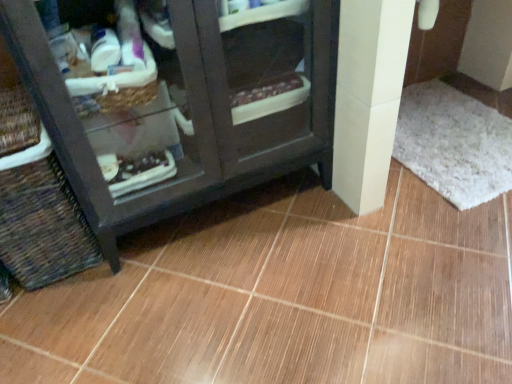
Identify the location of dark wood cabinet at lower left. The image size is (512, 384). (182, 104).

The width and height of the screenshot is (512, 384). Describe the element at coordinates (283, 296) in the screenshot. I see `brown glossy tile at center` at that location.

Describe the element at coordinates (42, 226) in the screenshot. I see `woven brown basket at lower left` at that location.

Find the location of a particular element. dark wood cabinet at lower left is located at coordinates (182, 104).

Where is `furniture in front of the white shaggy bath mat at lower right`? furniture in front of the white shaggy bath mat at lower right is located at coordinates (182, 104).

Is white shaggy bath mat at lower right turned away from dark wood cabinet at lower left?

No, white shaggy bath mat at lower right's orientation is not away from dark wood cabinet at lower left.

Between white shaggy bath mat at lower right and dark wood cabinet at lower left, which one has smaller size?

Smaller between the two is white shaggy bath mat at lower right.

Is point (16, 227) behind point (222, 169)?

No, it is in front of (222, 169).

Could you tell me if woven brown basket at lower left is turned towards dark wood cabinet at lower left?

No, woven brown basket at lower left is not oriented towards dark wood cabinet at lower left.

This screenshot has width=512, height=384. I want to click on basket below the dark wood cabinet at lower left (from the image's perspective), so click(x=42, y=226).

Can you confirm if woven brown basket at lower left is bigger than dark wood cabinet at lower left?

Incorrect, woven brown basket at lower left is not larger than dark wood cabinet at lower left.

Considering the sizes of brown glossy tile at center and dark wood cabinet at lower left in the image, is brown glossy tile at center wider or thinner than dark wood cabinet at lower left?

brown glossy tile at center is wider than dark wood cabinet at lower left.

Is brown glossy tile at center completely or partially outside of dark wood cabinet at lower left?

Indeed, brown glossy tile at center is completely outside dark wood cabinet at lower left.

Is brown glossy tile at center positioned with its back to dark wood cabinet at lower left?

No, brown glossy tile at center's orientation is not away from dark wood cabinet at lower left.

Considering the relative sizes of brown glossy tile at center and dark wood cabinet at lower left in the image provided, is brown glossy tile at center taller than dark wood cabinet at lower left?

In fact, brown glossy tile at center may be shorter than dark wood cabinet at lower left.

Is white shaggy bath mat at lower right looking in the opposite direction of brown glossy tile at center?

Correct, white shaggy bath mat at lower right is looking away from brown glossy tile at center.

In the scene shown: Considering the relative sizes of white shaggy bath mat at lower right and brown glossy tile at center in the image provided, is white shaggy bath mat at lower right wider than brown glossy tile at center?

In fact, white shaggy bath mat at lower right might be narrower than brown glossy tile at center.

Is white shaggy bath mat at lower right surrounding brown glossy tile at center?

No, brown glossy tile at center is not a part of white shaggy bath mat at lower right.

Is brown glossy tile at center positioned far away from woven brown basket at lower left?

That's not correct — brown glossy tile at center is a little close to woven brown basket at lower left.

Which object is thinner, brown glossy tile at center or woven brown basket at lower left?

woven brown basket at lower left.

Between brown glossy tile at center and woven brown basket at lower left, which one has less height?

brown glossy tile at center is shorter.

Can you confirm if woven brown basket at lower left is taller than brown glossy tile at center?

Yes.

Is point (42, 253) closer to camera compared to point (477, 358)?

No, it is behind (477, 358).

Find the location of `ceramic tile located on the right of woven brown basket at lower left`. ceramic tile located on the right of woven brown basket at lower left is located at coordinates (283, 296).

From the image's perspective, does dark wood cabinet at lower left appear lower than woven brown basket at lower left?

No.

Locate an element on the screen. The width and height of the screenshot is (512, 384). basket behind the dark wood cabinet at lower left is located at coordinates (42, 226).

Is dark wood cabinet at lower left in contact with woven brown basket at lower left?

No, dark wood cabinet at lower left is not with woven brown basket at lower left.

Between dark wood cabinet at lower left and woven brown basket at lower left, which one appears on the right side from the viewer's perspective?

From the viewer's perspective, dark wood cabinet at lower left appears more on the right side.

Where is `bath mat on the right of dark wood cabinet at lower left`? The image size is (512, 384). bath mat on the right of dark wood cabinet at lower left is located at coordinates (454, 142).

Locate an element on the screen. basket behind the dark wood cabinet at lower left is located at coordinates (42, 226).

Estimate the real-world distances between objects in this image. Which object is further from brown glossy tile at center, woven brown basket at lower left or dark wood cabinet at lower left?

woven brown basket at lower left.

When comparing their distances from brown glossy tile at center, does white shaggy bath mat at lower right or dark wood cabinet at lower left seem closer?

dark wood cabinet at lower left.

From the image, which object appears to be nearer to woven brown basket at lower left, white shaggy bath mat at lower right or dark wood cabinet at lower left?

The object closer to woven brown basket at lower left is dark wood cabinet at lower left.

Based on the photo, looking at the image, which one is located closer to woven brown basket at lower left, dark wood cabinet at lower left or brown glossy tile at center?

The object closer to woven brown basket at lower left is dark wood cabinet at lower left.

Based on their spatial positions, is dark wood cabinet at lower left or woven brown basket at lower left closer to white shaggy bath mat at lower right?

dark wood cabinet at lower left lies closer to white shaggy bath mat at lower right than the other object.

Based on their spatial positions, is woven brown basket at lower left or dark wood cabinet at lower left closer to white shaggy bath mat at lower right?

dark wood cabinet at lower left.

Based on the photo, from the image, which object appears to be nearer to dark wood cabinet at lower left, woven brown basket at lower left or brown glossy tile at center?

woven brown basket at lower left is positioned closer to the anchor dark wood cabinet at lower left.

Looking at the image, which one is located further to woven brown basket at lower left, brown glossy tile at center or dark wood cabinet at lower left?

brown glossy tile at center.

Image resolution: width=512 pixels, height=384 pixels. Identify the location of ceramic tile located between dark wood cabinet at lower left and white shaggy bath mat at lower right in the left-right direction. (283, 296).

What are the coordinates of `furniture located between woven brown basket at lower left and white shaggy bath mat at lower right in the left-right direction` in the screenshot? It's located at (182, 104).

What are the coordinates of `ceramic tile between woven brown basket at lower left and white shaggy bath mat at lower right` in the screenshot? It's located at (283, 296).

You are a GUI agent. You are given a task and a screenshot of the screen. Output one action in this format:
    pyautogui.click(x=<x>, y=<y>)
    Task: Click on the furniture between woven brown basket at lower left and brown glossy tile at center in the horizontal direction
    Image resolution: width=512 pixels, height=384 pixels.
    Given the screenshot: What is the action you would take?
    pyautogui.click(x=182, y=104)